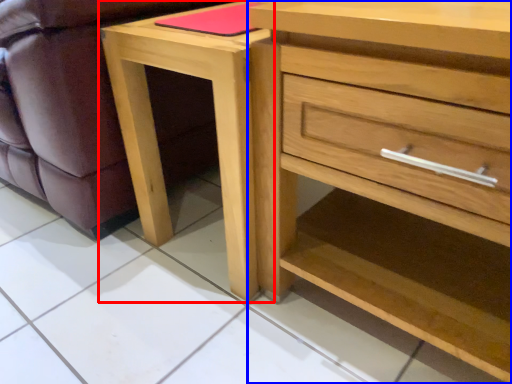
Question: Which object is closer to the camera taking this photo, nightstand (highlighted by a red box) or chest of drawers (highlighted by a blue box)?

Choices:
 (A) nightstand
 (B) chest of drawers

Answer: (B)